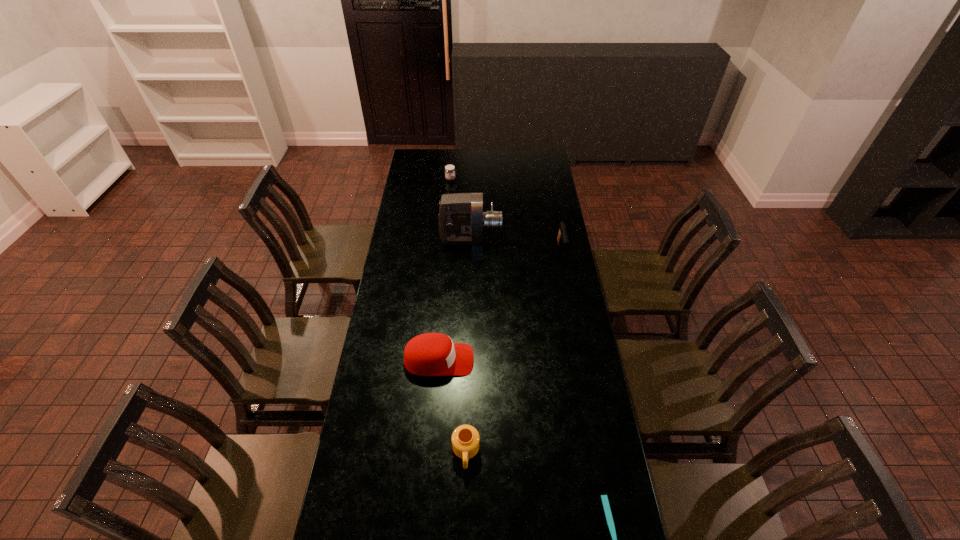
In order to click on blank space located 0.380m on the front label of the farthest object in this screenshot , I will do `click(522, 179)`.

I want to click on object that is at the left edge, so click(x=431, y=354).

The image size is (960, 540). What are the coordinates of `object at the right edge` in the screenshot? It's located at [562, 238].

Image resolution: width=960 pixels, height=540 pixels. Identify the location of vacant point at the left edge. (418, 253).

Locate an element on the screen. Image resolution: width=960 pixels, height=540 pixels. vacant space at the right edge of the desktop is located at coordinates (531, 197).

In the image, there is a desktop. Where is `vacant space at the far left corner`? vacant space at the far left corner is located at coordinates (418, 170).

Find the location of a particular element. This screenshot has height=540, width=960. free area in between the pistol and the camcorder is located at coordinates (516, 245).

At what (x,y) coordinates should I click in order to perform the action: click on vacant space that is in between the pistol and the jam. Please return your answer as a coordinate pair (x, y). The height and width of the screenshot is (540, 960). Looking at the image, I should click on (506, 215).

Locate an element on the screen. free space between the mug and the pistol is located at coordinates (514, 352).

Where is `unoccupied position between the second nearest object and the pistol`? unoccupied position between the second nearest object and the pistol is located at coordinates (514, 352).